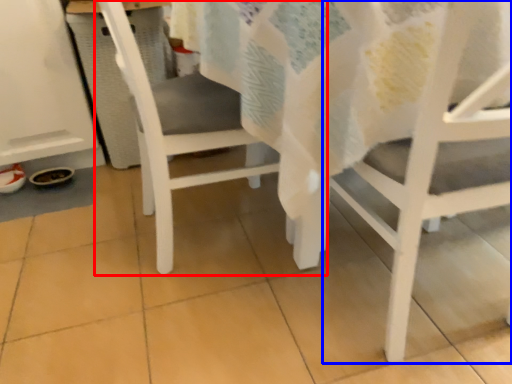
Question: Which of the following is the farthest to the observer, chair (highlighted by a red box) or chair (highlighted by a blue box)?

Choices:
 (A) chair
 (B) chair

Answer: (A)